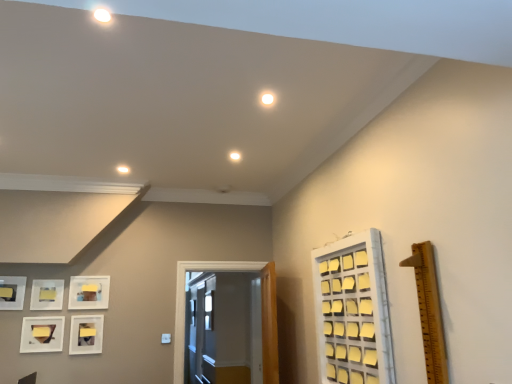
Question: Does white glossy door at center have a greater height compared to wooden ruler at right?

Choices:
 (A) yes
 (B) no

Answer: (A)

Question: From the image's perspective, is white glossy door at center below wooden ruler at right?

Choices:
 (A) yes
 (B) no

Answer: (A)

Question: Could you tell me if white glossy door at center is facing wooden ruler at right?

Choices:
 (A) yes
 (B) no

Answer: (A)

Question: Is white glossy door at center thinner than wooden ruler at right?

Choices:
 (A) no
 (B) yes

Answer: (B)

Question: Is white glossy door at center at the right side of wooden ruler at right?

Choices:
 (A) no
 (B) yes

Answer: (A)

Question: Is wooden ruler at right surrounded by white glossy door at center?

Choices:
 (A) no
 (B) yes

Answer: (A)

Question: Is white glossy door at center smaller than matte white picture frame at lower left, acting as the third picture frame starting from the right?

Choices:
 (A) yes
 (B) no

Answer: (B)

Question: Is white glossy door at center with matte white picture frame at lower left, acting as the third picture frame starting from the right?

Choices:
 (A) yes
 (B) no

Answer: (B)

Question: Considering the relative positions of white glossy door at center and matte white picture frame at lower left, the 3th picture frame from the left, in the image provided, is white glossy door at center behind matte white picture frame at lower left, the 3th picture frame from the left,?

Choices:
 (A) no
 (B) yes

Answer: (B)

Question: From the image's perspective, does white glossy door at center appear lower than matte white picture frame at lower left, acting as the third picture frame starting from the right?

Choices:
 (A) no
 (B) yes

Answer: (B)

Question: Is white glossy door at center shorter than matte white picture frame at lower left, acting as the third picture frame starting from the right?

Choices:
 (A) no
 (B) yes

Answer: (A)

Question: From a real-world perspective, is white glossy door at center on top of matte white picture frame at lower left, the 3th picture frame from the left?

Choices:
 (A) no
 (B) yes

Answer: (B)

Question: From a real-world perspective, is wooden ruler at right over white glossy door at center?

Choices:
 (A) yes
 (B) no

Answer: (A)